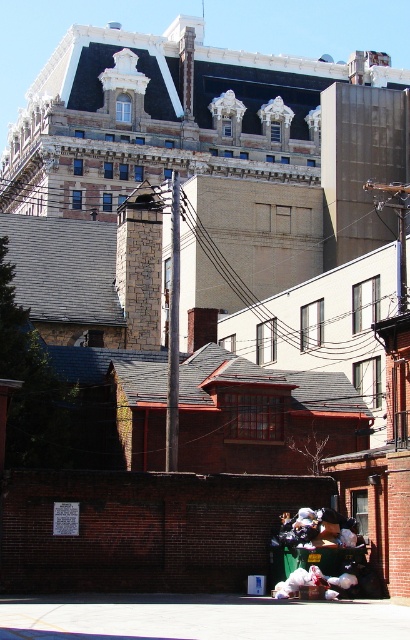
Between smooth gray pole at center and black plastic bags at lower center, which one is positioned higher?

smooth gray pole at center is higher up.

Measure the distance between point (168,387) and camera.

Point (168,387) is 43.71 meters from camera.

Is point (177, 412) closer to viewer compared to point (337, 538)?

No.

Locate an element on the screen. The image size is (410, 640). smooth gray pole at center is located at coordinates (173, 332).